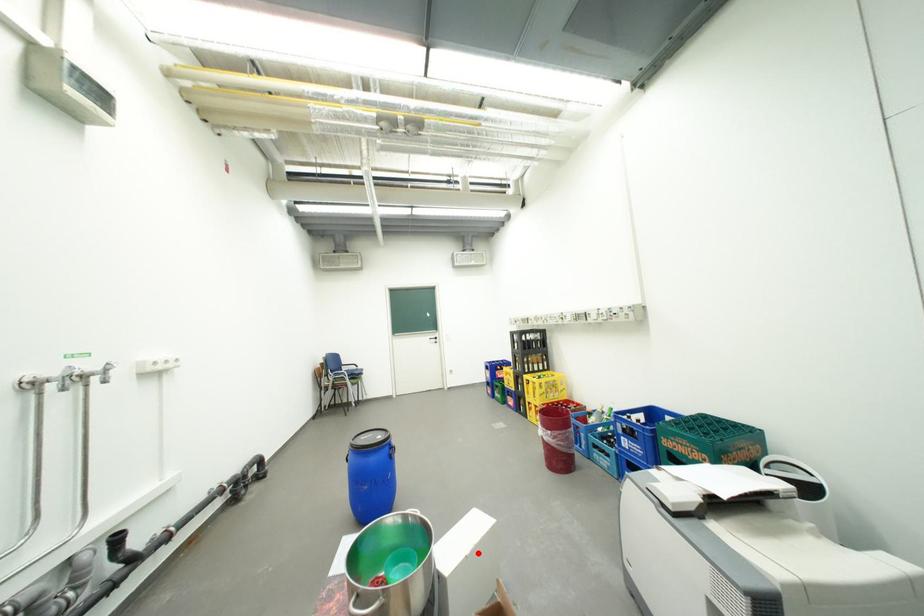
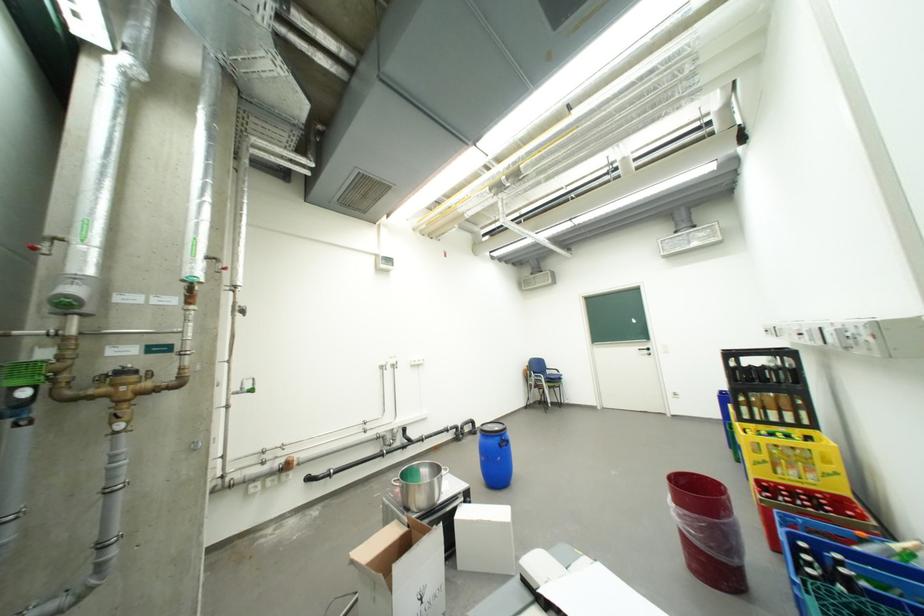
Question: I am providing you with two images of the same scene from different viewpoints. In image1, a red point is highlighted. Considering the same 3D point in image2, which of the following is correct?

Choices:
 (A) It is closer
 (B) It is farther

Answer: (A)